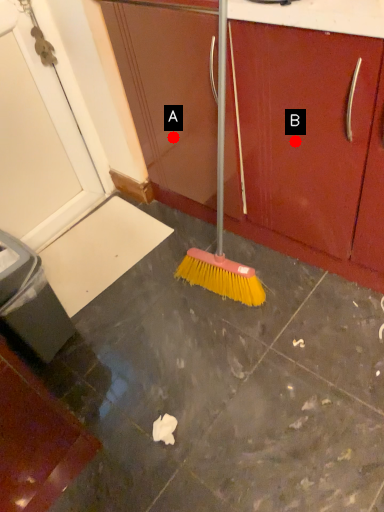
Question: Two points are circled on the image, labeled by A and B beside each circle. Which point is further to the camera?

Choices:
 (A) A is further
 (B) B is further

Answer: (A)